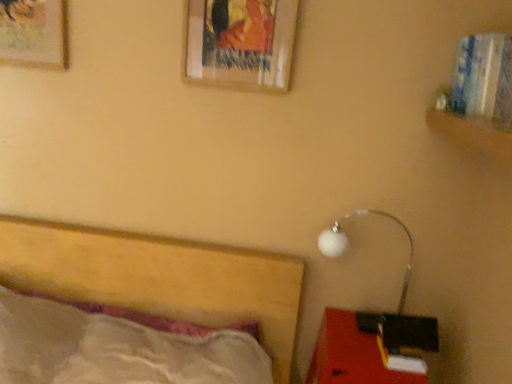
This screenshot has width=512, height=384. Describe the element at coordinates (34, 32) in the screenshot. I see `wooden picture frame at upper left, the second picture frame viewed from the right` at that location.

This screenshot has width=512, height=384. Describe the element at coordinates (348, 243) in the screenshot. I see `white glossy lamp at lower right` at that location.

Where is `wooden picture frame at upper left, the first picture frame viewed from the left`? Image resolution: width=512 pixels, height=384 pixels. wooden picture frame at upper left, the first picture frame viewed from the left is located at coordinates 34,32.

Which of these two, wooden picture frame at upper left, the first picture frame viewed from the left, or wooden picture frame at upper center, which is the 1th picture frame from right to left, is smaller?

Smaller between the two is wooden picture frame at upper left, the first picture frame viewed from the left.

Is wooden picture frame at upper left, the first picture frame viewed from the left, spatially inside wooden picture frame at upper center, which is the 1th picture frame from right to left, or outside of it?

wooden picture frame at upper left, the first picture frame viewed from the left, cannot be found inside wooden picture frame at upper center, which is the 1th picture frame from right to left.

Considering the relative sizes of wooden picture frame at upper left, the first picture frame viewed from the left, and wooden picture frame at upper center, positioned as the second picture frame in left-to-right order, in the image provided, is wooden picture frame at upper left, the first picture frame viewed from the left, taller than wooden picture frame at upper center, positioned as the second picture frame in left-to-right order,?

No.

Would you say white glossy lamp at lower right is part of wooden picture frame at upper center, positioned as the second picture frame in left-to-right order,'s contents?

No, white glossy lamp at lower right is not surrounded by wooden picture frame at upper center, positioned as the second picture frame in left-to-right order.

Is wooden picture frame at upper center, positioned as the second picture frame in left-to-right order, bigger than white glossy lamp at lower right?

No, wooden picture frame at upper center, positioned as the second picture frame in left-to-right order, is not bigger than white glossy lamp at lower right.

From a real-world perspective, which object stands above the other?

wooden picture frame at upper center, which is the 1th picture frame from right to left, is physically above.

Is point (230, 58) less distant than point (338, 254)?

Yes, point (230, 58) is in front of point (338, 254).

Considering the sizes of objects wooden picture frame at upper left, the first picture frame viewed from the left, and white glossy lamp at lower right in the image provided, who is smaller, wooden picture frame at upper left, the first picture frame viewed from the left, or white glossy lamp at lower right?

wooden picture frame at upper left, the first picture frame viewed from the left.

From a real-world perspective, is wooden picture frame at upper left, the second picture frame viewed from the right, below white glossy lamp at lower right?

Actually, wooden picture frame at upper left, the second picture frame viewed from the right, is physically above white glossy lamp at lower right in the real world.

Is wooden picture frame at upper left, the first picture frame viewed from the left, thinner than white glossy lamp at lower right?

Yes.

Between point (357, 319) and point (0, 36), which one is positioned behind?

The point (357, 319) is more distant.

Where is `the 2nd picture frame above the matte red desk at lower right (from the image's perspective)`? the 2nd picture frame above the matte red desk at lower right (from the image's perspective) is located at coordinates (34, 32).

Is matte red desk at lower right aimed at wooden picture frame at upper left, the first picture frame viewed from the left?

No, matte red desk at lower right is not facing towards wooden picture frame at upper left, the first picture frame viewed from the left.

From a real-world perspective, between matte red desk at lower right and wooden picture frame at upper left, the first picture frame viewed from the left, who is vertically higher?

From a 3D spatial view, wooden picture frame at upper left, the first picture frame viewed from the left, is above.

Is white glossy lamp at lower right not close to wooden picture frame at upper center, which is the 1th picture frame from right to left?

Actually, white glossy lamp at lower right and wooden picture frame at upper center, which is the 1th picture frame from right to left, are a little close together.

From a real-world perspective, is white glossy lamp at lower right on top of wooden picture frame at upper center, positioned as the second picture frame in left-to-right order?

No, from a real-world perspective, white glossy lamp at lower right is not over wooden picture frame at upper center, positioned as the second picture frame in left-to-right order

Considering the points (325, 241) and (222, 6), which point is in front, point (325, 241) or point (222, 6)?

Point (222, 6)

Considering the sizes of white glossy lamp at lower right and wooden picture frame at upper center, which is the 1th picture frame from right to left, in the image, is white glossy lamp at lower right wider or thinner than wooden picture frame at upper center, which is the 1th picture frame from right to left,?

Considering their sizes, white glossy lamp at lower right looks broader than wooden picture frame at upper center, which is the 1th picture frame from right to left.

From a real-world perspective, which is physically below, wooden picture frame at upper center, which is the 1th picture frame from right to left, or matte red desk at lower right?

matte red desk at lower right, from a real-world perspective.

Which of these two, wooden picture frame at upper center, positioned as the second picture frame in left-to-right order, or matte red desk at lower right, is wider?

matte red desk at lower right.

Does wooden picture frame at upper center, which is the 1th picture frame from right to left, appear on the right side of matte red desk at lower right?

In fact, wooden picture frame at upper center, which is the 1th picture frame from right to left, is to the left of matte red desk at lower right.

Measure the distance from wooden picture frame at upper center, which is the 1th picture frame from right to left, to matte red desk at lower right.

A distance of 1.13 meters exists between wooden picture frame at upper center, which is the 1th picture frame from right to left, and matte red desk at lower right.

Does matte red desk at lower right have a lesser height compared to wooden picture frame at upper center, positioned as the second picture frame in left-to-right order?

No.

Consider the image. Can you tell me how much matte red desk at lower right and wooden picture frame at upper center, which is the 1th picture frame from right to left, differ in facing direction?

The angular difference between matte red desk at lower right and wooden picture frame at upper center, which is the 1th picture frame from right to left, is 0.5 degrees.

From the image's perspective, relative to wooden picture frame at upper center, positioned as the second picture frame in left-to-right order, is matte red desk at lower right above or below?

matte red desk at lower right is below wooden picture frame at upper center, positioned as the second picture frame in left-to-right order.

Can you confirm if matte red desk at lower right is bigger than wooden picture frame at upper center, positioned as the second picture frame in left-to-right order?

Correct, matte red desk at lower right is larger in size than wooden picture frame at upper center, positioned as the second picture frame in left-to-right order.

The width and height of the screenshot is (512, 384). Identify the location of picture frame located on the left of wooden picture frame at upper center, which is the 1th picture frame from right to left. (34, 32).

Where is `picture frame in front of the white glossy lamp at lower right`? picture frame in front of the white glossy lamp at lower right is located at coordinates (240, 43).

Which object lies nearer to the anchor point white glossy lamp at lower right, matte red desk at lower right or wooden picture frame at upper center, positioned as the second picture frame in left-to-right order?

The object closer to white glossy lamp at lower right is matte red desk at lower right.

In the scene shown: Looking at the image, which one is located further to wooden picture frame at upper left, the first picture frame viewed from the left, matte red desk at lower right or wooden picture frame at upper center, positioned as the second picture frame in left-to-right order?

Among the two, matte red desk at lower right is located further to wooden picture frame at upper left, the first picture frame viewed from the left.

Estimate the real-world distances between objects in this image. Which object is further from matte red desk at lower right, white glossy lamp at lower right or wooden picture frame at upper left, the second picture frame viewed from the right?

wooden picture frame at upper left, the second picture frame viewed from the right, is further to matte red desk at lower right.

Which object lies further to the anchor point wooden picture frame at upper center, positioned as the second picture frame in left-to-right order, wooden picture frame at upper left, the second picture frame viewed from the right, or white glossy lamp at lower right?

The object further to wooden picture frame at upper center, positioned as the second picture frame in left-to-right order, is white glossy lamp at lower right.

From the image, which object appears to be nearer to wooden picture frame at upper center, which is the 1th picture frame from right to left, white glossy lamp at lower right or wooden picture frame at upper left, the first picture frame viewed from the left?

wooden picture frame at upper left, the first picture frame viewed from the left, lies closer to wooden picture frame at upper center, which is the 1th picture frame from right to left, than the other object.

Based on their spatial positions, is wooden picture frame at upper left, the second picture frame viewed from the right, or wooden picture frame at upper center, positioned as the second picture frame in left-to-right order, further from white glossy lamp at lower right?

Among the two, wooden picture frame at upper left, the second picture frame viewed from the right, is located further to white glossy lamp at lower right.

When comparing their distances from matte red desk at lower right, does wooden picture frame at upper center, which is the 1th picture frame from right to left, or white glossy lamp at lower right seem closer?

white glossy lamp at lower right is positioned closer to the anchor matte red desk at lower right.

Which object lies nearer to the anchor point matte red desk at lower right, wooden picture frame at upper left, the first picture frame viewed from the left, or white glossy lamp at lower right?

white glossy lamp at lower right.

In order to click on picture frame between wooden picture frame at upper left, the second picture frame viewed from the right, and matte red desk at lower right in the up-down direction in this screenshot , I will do `click(240, 43)`.

Find the location of a particular element. lamp between wooden picture frame at upper center, positioned as the second picture frame in left-to-right order, and matte red desk at lower right in the up-down direction is located at coordinates (348, 243).

This screenshot has height=384, width=512. In order to click on picture frame situated between wooden picture frame at upper left, the first picture frame viewed from the left, and white glossy lamp at lower right from left to right in this screenshot , I will do `click(240, 43)`.

Where is `furniture situated between wooden picture frame at upper left, the second picture frame viewed from the right, and white glossy lamp at lower right from left to right`? furniture situated between wooden picture frame at upper left, the second picture frame viewed from the right, and white glossy lamp at lower right from left to right is located at coordinates (372, 348).